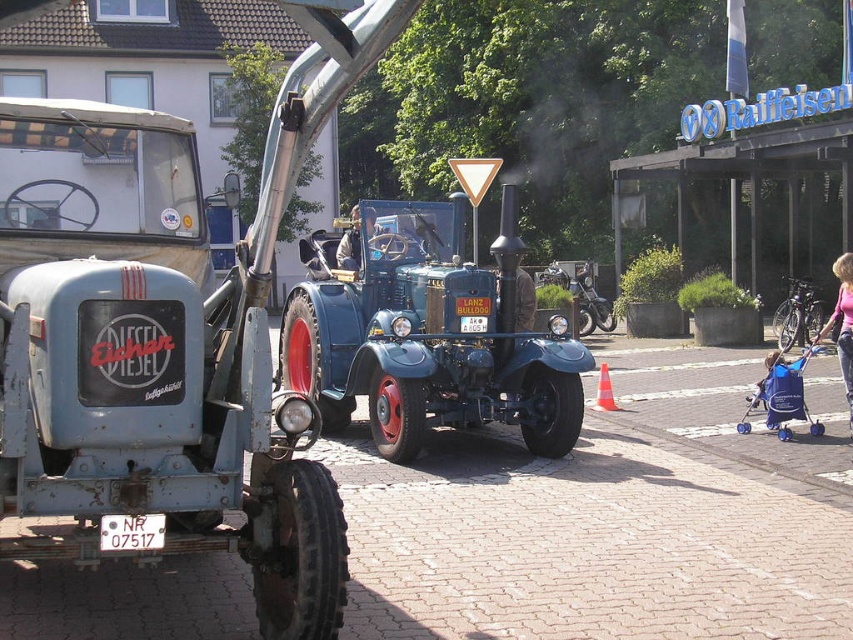
Question: Which point is farther to the camera?

Choices:
 (A) blue metallic tractor at center
 (B) matte blue tow truck at left

Answer: (A)

Question: Which of the following is the farthest from the observer?

Choices:
 (A) (321, 589)
 (B) (318, 339)

Answer: (B)

Question: Can you confirm if matte blue tow truck at left is positioned below blue metallic tractor at center?

Choices:
 (A) yes
 (B) no

Answer: (A)

Question: Can you confirm if matte blue tow truck at left is bigger than blue metallic tractor at center?

Choices:
 (A) no
 (B) yes

Answer: (A)

Question: Where is matte blue tow truck at left located in relation to blue metallic tractor at center in the image?

Choices:
 (A) right
 (B) left

Answer: (B)